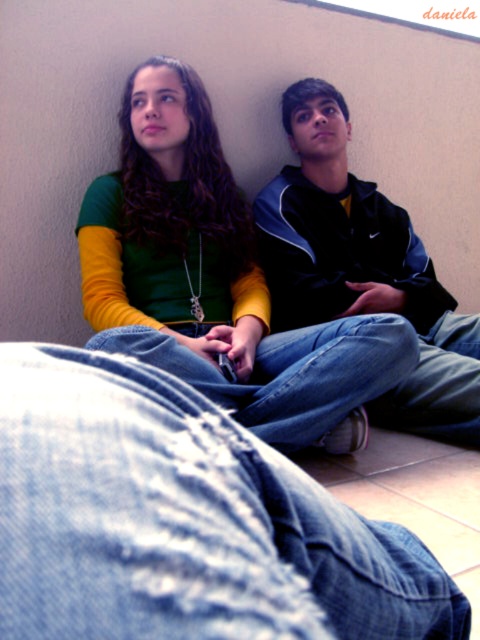
Question: Based on their relative distances, which object is nearer to the denim at center?

Choices:
 (A) denim at lower right
 (B) matte green shirt at upper left
 (C) blue denim jeans at center
 (D) denim jeans at center

Answer: (B)

Question: Observing the image, what is the correct spatial positioning of denim at center in reference to denim at lower right?

Choices:
 (A) left
 (B) right

Answer: (A)

Question: Is denim jeans at center positioned behind denim at lower right?

Choices:
 (A) no
 (B) yes

Answer: (A)

Question: Among these points, which one is farthest from the camera?

Choices:
 (A) (358, 424)
 (B) (166, 614)

Answer: (A)

Question: Does denim jeans at center appear under blue denim jeans at center?

Choices:
 (A) no
 (B) yes

Answer: (B)

Question: Estimate the real-world distances between objects in this image. Which object is closer to the denim at center?

Choices:
 (A) matte green shirt at upper left
 (B) blue denim jeans at center
 (C) denim jeans at center
 (D) denim at lower right

Answer: (A)